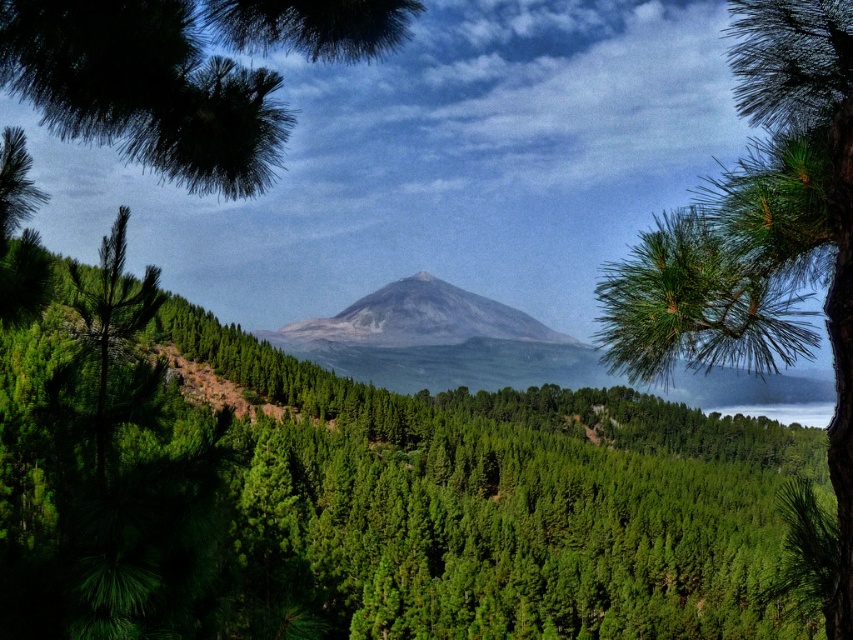
Between green needle-like at right and green matte pine branch at upper left, which one is positioned higher?

green needle-like at right is higher up.

Who is shorter, green needle-like at right or green matte pine branch at upper left?

Standing shorter between the two is green matte pine branch at upper left.

Is point (602, 316) in front of point (155, 131)?

Yes.

In order to click on green needle-like at right in this screenshot , I will do `click(761, 237)`.

Can you confirm if green matte pine branch at upper left is positioned to the left of gray matte mountain at center?

Yes, green matte pine branch at upper left is to the left of gray matte mountain at center.

Does green matte pine branch at upper left appear under gray matte mountain at center?

Actually, green matte pine branch at upper left is above gray matte mountain at center.

Does point (384, 8) lie in front of point (383, 342)?

Yes, it is.

Identify the location of green matte pine branch at upper left. This screenshot has width=853, height=640. (183, 74).

Can you confirm if green needle-like at right is shorter than gray matte mountain at center?

No, green needle-like at right is not shorter than gray matte mountain at center.

Does point (830, 256) come behind point (425, 342)?

No, it is not.

Is point (834, 17) less distant than point (410, 307)?

Yes, it is.

What are the coordinates of `green needle-like at right` in the screenshot? It's located at (761, 237).